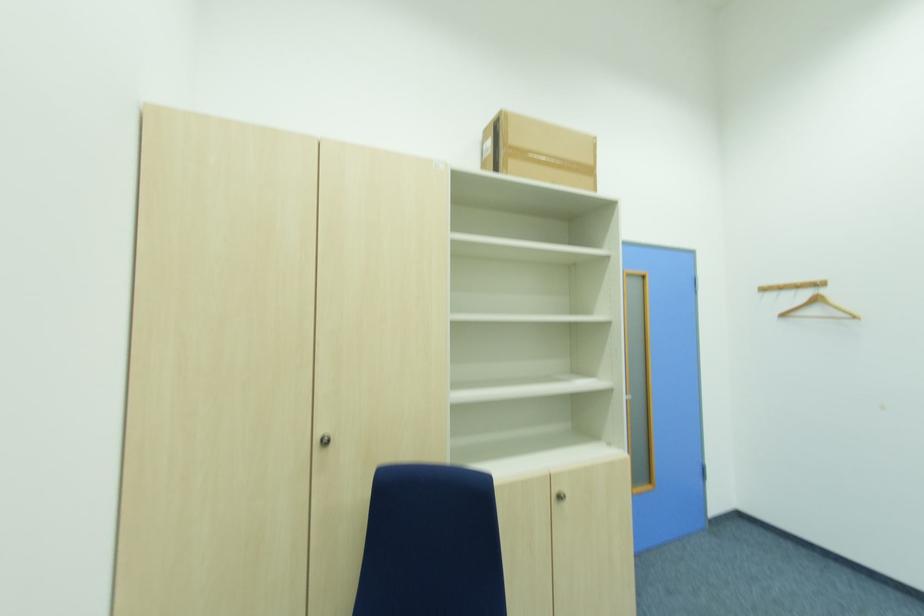
Identify the location of cardboard box. The height and width of the screenshot is (616, 924). (539, 151).